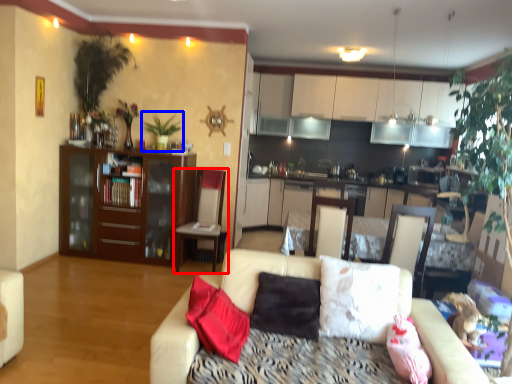
Question: Which object appears closest to the camera in this image, chair (highlighted by a red box) or plant (highlighted by a blue box)?

Choices:
 (A) chair
 (B) plant

Answer: (A)